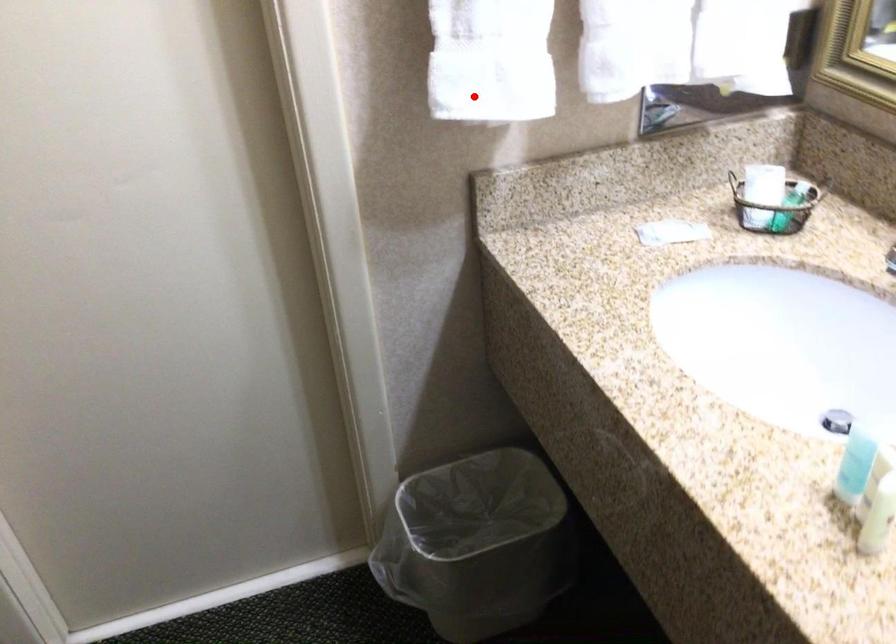
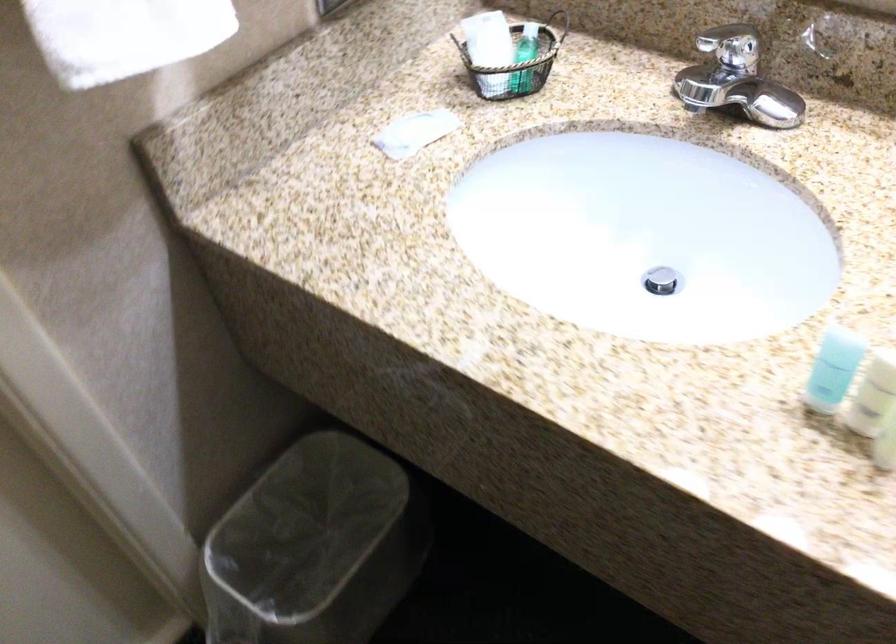
In the second image, find the point that corresponds to the highlighted location in the first image.

(124, 35)